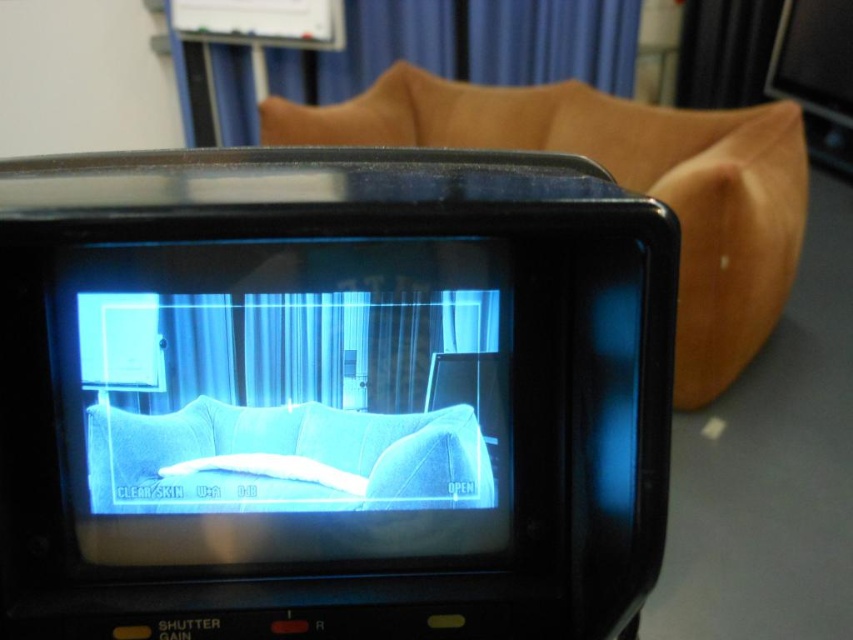
You are setting up a video call and need to adjust the camera so the brown leather couch at upper center is fully visible. The black plastic video camera at center is currently positioned where? Is it closer to or farther from you compared to the couch?

The black plastic video camera at center is in front of the brown leather couch at upper center, so it is closer to you than the couch.

Consider the image. You are positioning a new piece of furniture in the room shown in the video camera screen. The blue fabric couch at center is currently at coordinates 0.625, 0.340. If you want to place a new table exactly 0.1 units to the right of the couch, what would be the new coordinates for the table?

The blue fabric couch at center is located at point (289, 400). To place the table 0.1 units to the right, add 0.1 to the x coordinate. The new coordinates would be (289, 464).

You are looking at the video camera screen showing the room. There are two points marked on the screen at coordinates point (296, 273) and point (334, 433). Which point is nearer to you as you view the screen?

Point (296, 273) is closer to the viewer than point (334, 433).